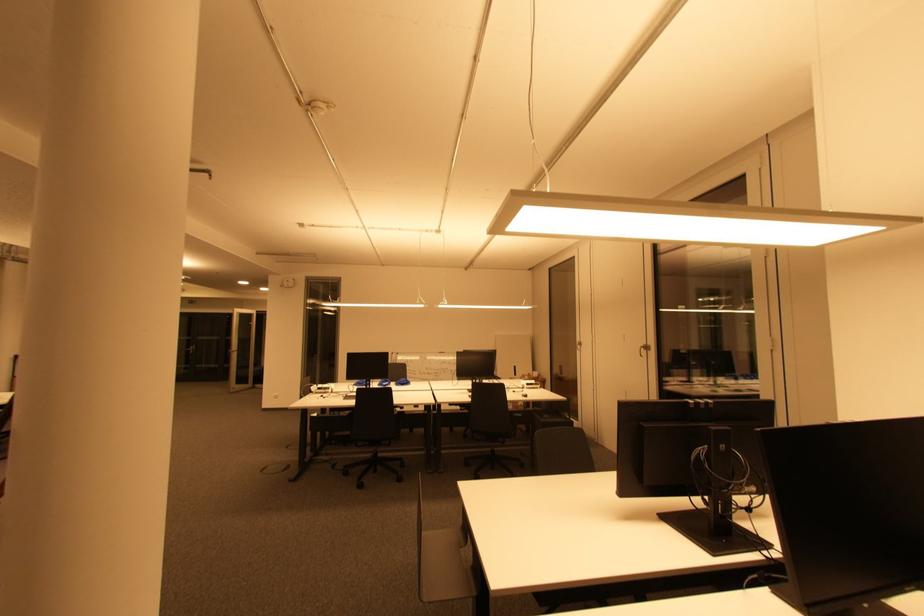
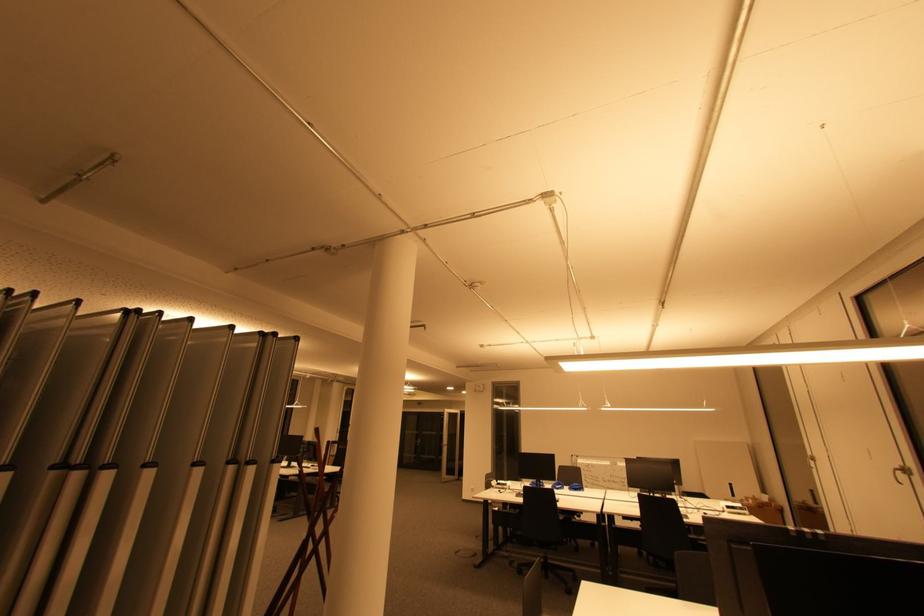
Based on the continuous images, in which direction is the camera rotating?

The camera's rotation is toward left-up.